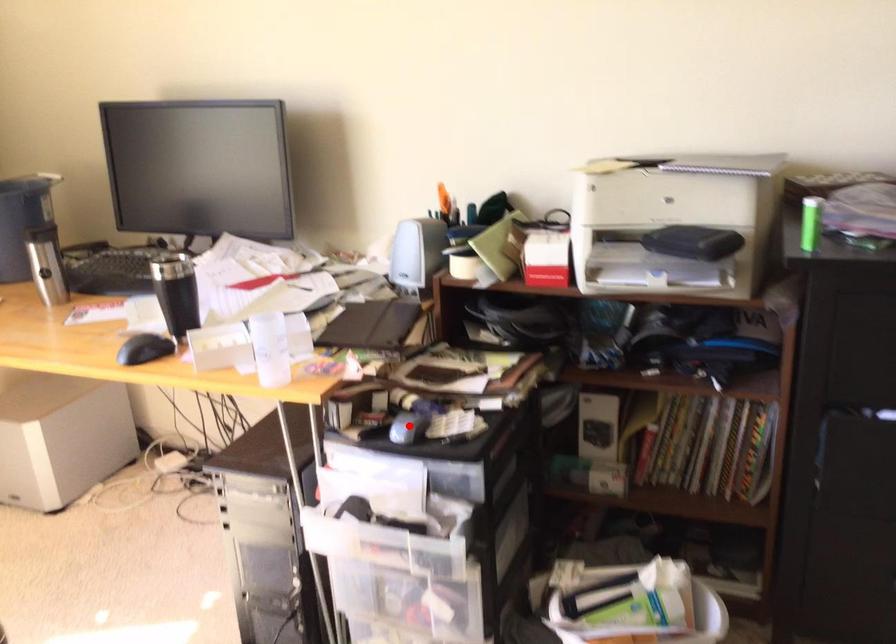
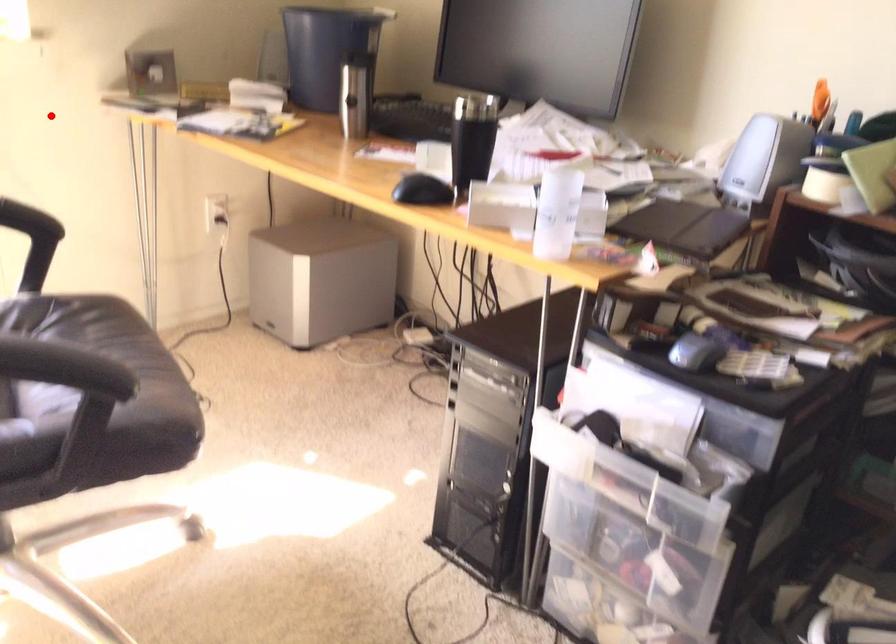
I am providing you with two images of the same scene from different viewpoints. A red point is marked on the first image and another point is marked on the second image. Does the point marked in image1 correspond to the same location as the one in image2?

No